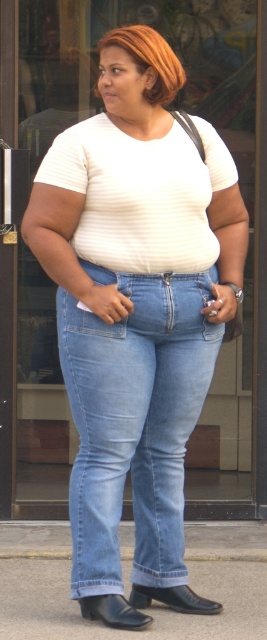
You are a fashion designer analyzing the outfit of a person in an image. The person is wearing a light blue denim jeans at center and a white striped shirt at center. Which piece of clothing is longer?

The light blue denim jeans at center is much taller than the white striped shirt at center, so the jeans are longer.

You are a fashion designer analyzing the outfit of the person in the image. The person is wearing a white striped shirt at center and has shiny orange hair at center. Which of these two has a greater width?

The white striped shirt at center has a greater width than the shiny orange hair at center according to the description provided.